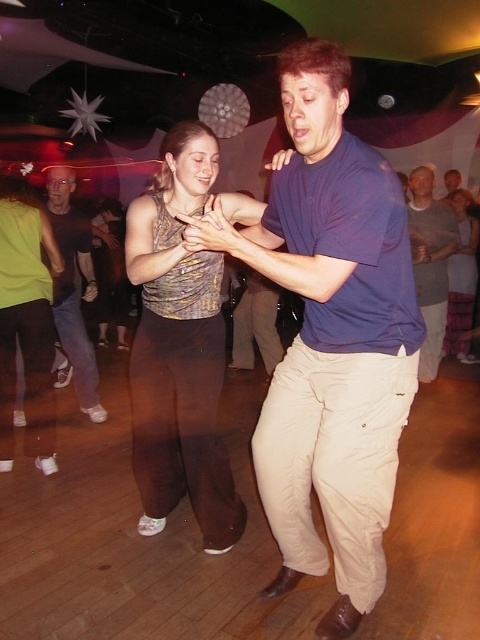
Measure the distance from metallic silver blouse at center to khaki pants at center.

metallic silver blouse at center is 2.12 meters from khaki pants at center.

Who is higher up, metallic silver blouse at center or khaki pants at center?

khaki pants at center

In order to click on metallic silver blouse at center in this screenshot , I will do `click(180, 349)`.

The image size is (480, 640). What do you see at coordinates (180, 349) in the screenshot? I see `metallic silver blouse at center` at bounding box center [180, 349].

Image resolution: width=480 pixels, height=640 pixels. In order to click on metallic silver blouse at center in this screenshot , I will do `click(180, 349)`.

Can you confirm if matte black shirt at left is positioned below khaki pants at center?

Actually, matte black shirt at left is above khaki pants at center.

Who is lower down, matte black shirt at left or khaki pants at center?

khaki pants at center is lower down.

In order to click on matte black shirt at left in this screenshot , I will do `click(73, 289)`.